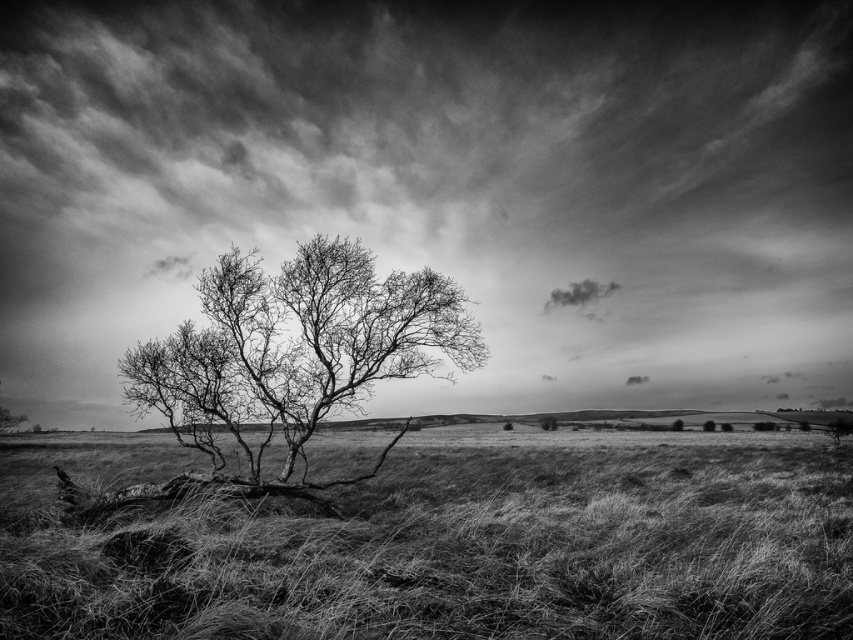
You are standing in the field looking at the cloudy sky at upper center and the fuzzy white cloud at upper center. Which one is closer to you?

The cloudy sky at upper center and the fuzzy white cloud at upper center are both at the same distance from you since they are both located at the upper center of the image.

You are standing at the base of the solitary tree in the image. Looking up, you notice a point marked at coordinates (439, 186). Based on the scene description, where exactly is this point located in relation to the tree and the surrounding environment?

The point at coordinates (439, 186) is located on the cloudy sky at upper center, which is above the solitary tree and the open field in the background.